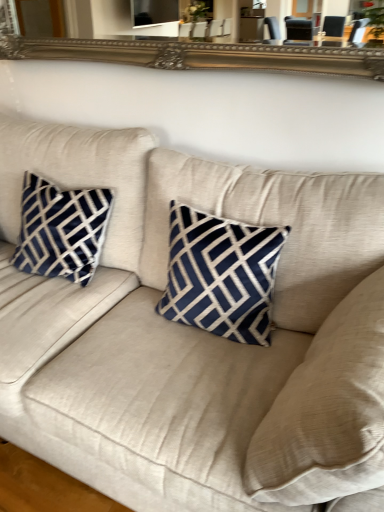
In order to face navy blue velvet pillow at left, should I rotate leftwards or rightwards?

Turn left approximately 17.759 degrees to face it.

The image size is (384, 512). What do you see at coordinates (61, 230) in the screenshot?
I see `navy blue velvet pillow at left` at bounding box center [61, 230].

At what (x,y) coordinates should I click in order to perform the action: click on navy blue velvet pillow at left. Please return your answer as a coordinate pair (x, y). Image resolution: width=384 pixels, height=512 pixels. Looking at the image, I should click on (61, 230).

The width and height of the screenshot is (384, 512). What are the coordinates of `navy blue velvet pillow at left` in the screenshot? It's located at (61, 230).